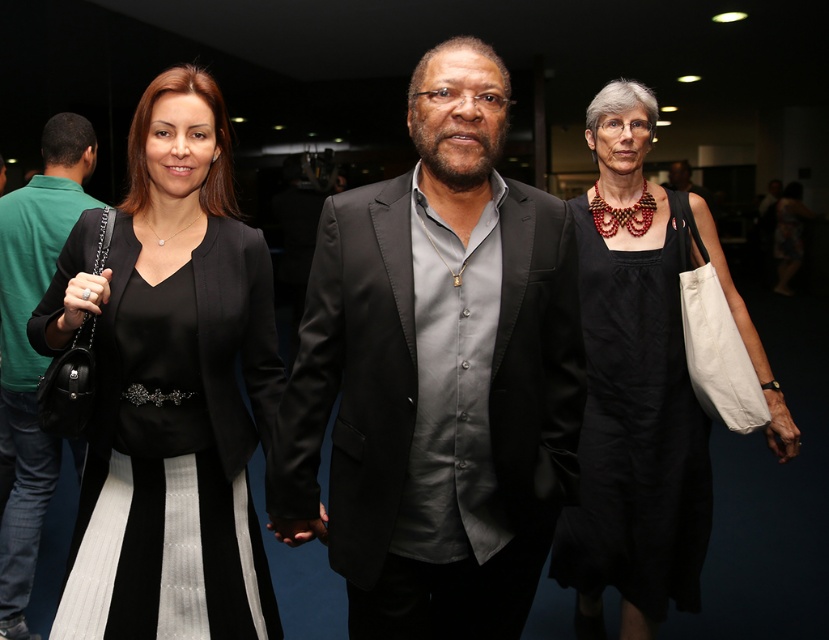
Who is positioned more to the right, black cotton dress at right or matte black blazer at center?

black cotton dress at right

Can you confirm if black cotton dress at right is shorter than matte black blazer at center?

Yes, black cotton dress at right is shorter than matte black blazer at center.

I want to click on black cotton dress at right, so click(x=634, y=435).

Locate an element on the screen. black cotton dress at right is located at coordinates (634, 435).

Is satin black suit at center behind matte black blazer at center?

No.

Who is more forward, [352,352] or [23,296]?

Point [352,352] is more forward.

Does point (458, 504) come in front of point (17, 433)?

Yes, it is.

You are a GUI agent. You are given a task and a screenshot of the screen. Output one action in this format:
    pyautogui.click(x=<x>, y=<y>)
    Task: Click on the satin black suit at center
    The width and height of the screenshot is (829, 640).
    Given the screenshot: What is the action you would take?
    pyautogui.click(x=437, y=376)

Can you confirm if black satin dress at left is positioned to the left of black cotton dress at right?

Indeed, black satin dress at left is positioned on the left side of black cotton dress at right.

Does black satin dress at left appear over black cotton dress at right?

Indeed, black satin dress at left is positioned over black cotton dress at right.

The height and width of the screenshot is (640, 829). I want to click on black satin dress at left, so click(x=183, y=428).